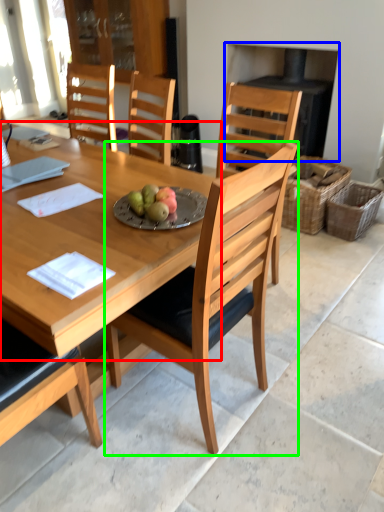
Question: Which object is the farthest from round table (highlighted by a red box)? Choose among these: fireplace (highlighted by a blue box) or chair (highlighted by a green box).

Choices:
 (A) fireplace
 (B) chair

Answer: (A)